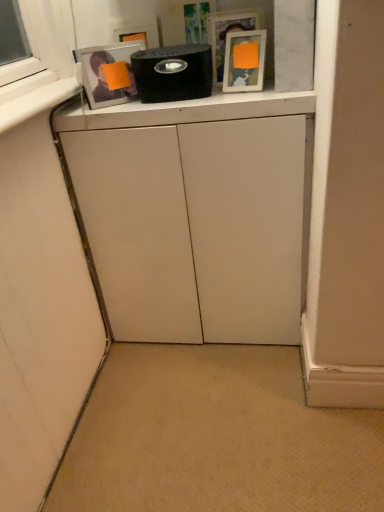
Identify the location of space that is in front of white matte cabinet at center. Image resolution: width=384 pixels, height=512 pixels. (207, 413).